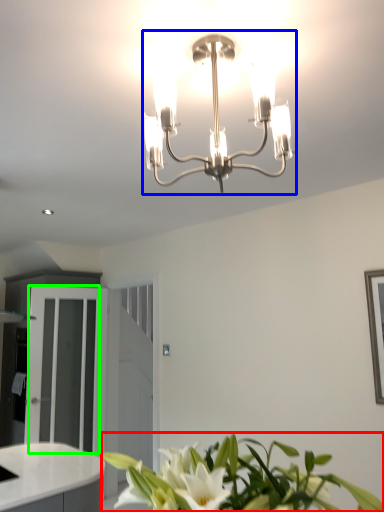
Question: Based on their relative distances, which object is farther from houseplant (highlighted by a red box)? Choose from lamp (highlighted by a blue box) and glass door (highlighted by a green box).

Choices:
 (A) lamp
 (B) glass door

Answer: (B)